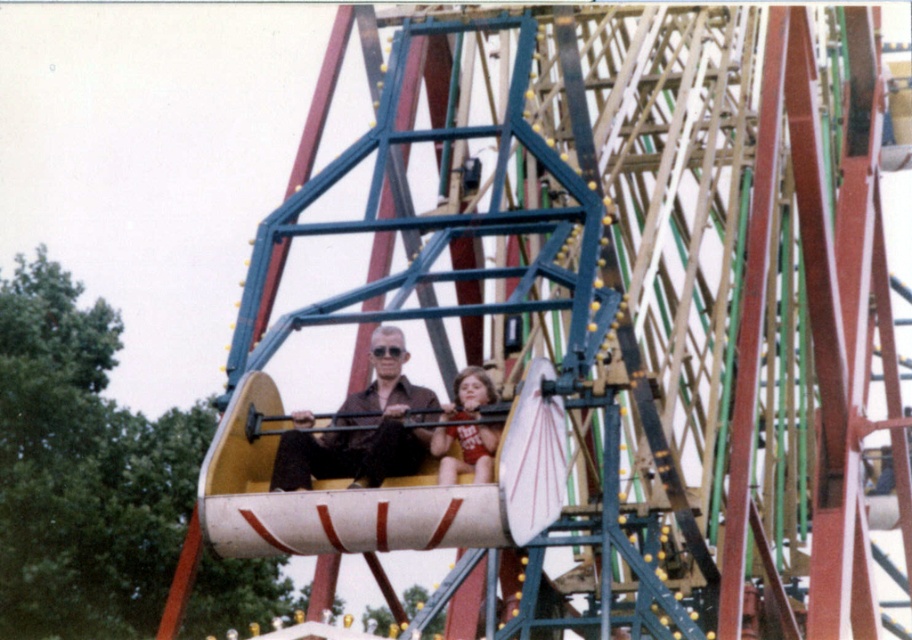
Based on the photo, is the position of matte brown shirt at center more distant than that of matte red swimsuit at center?

Yes, matte brown shirt at center is further from the viewer.

Measure the distance from matte brown shirt at center to matte red swimsuit at center.

matte brown shirt at center and matte red swimsuit at center are 3.59 meters apart.

Does point (370, 470) come farther from viewer compared to point (459, 429)?

No, (370, 470) is closer to viewer.

The height and width of the screenshot is (640, 912). In order to click on matte brown shirt at center in this screenshot , I will do `click(361, 429)`.